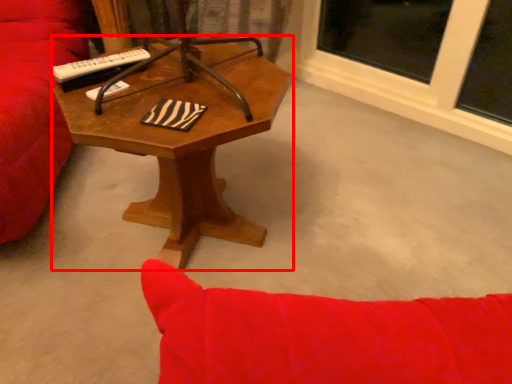
Question: Where is coffee table (annotated by the red box) located in relation to remote control in the image?

Choices:
 (A) left
 (B) right

Answer: (B)